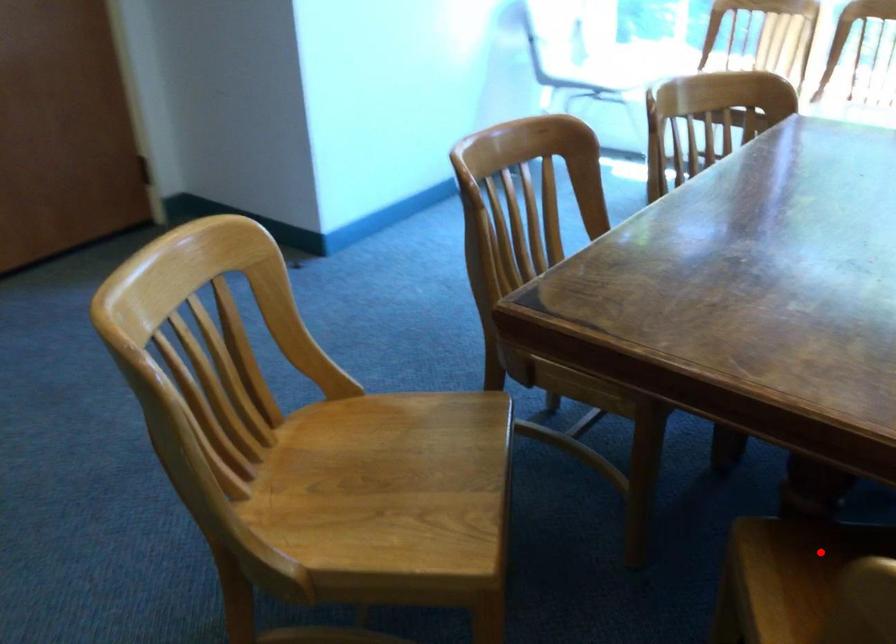
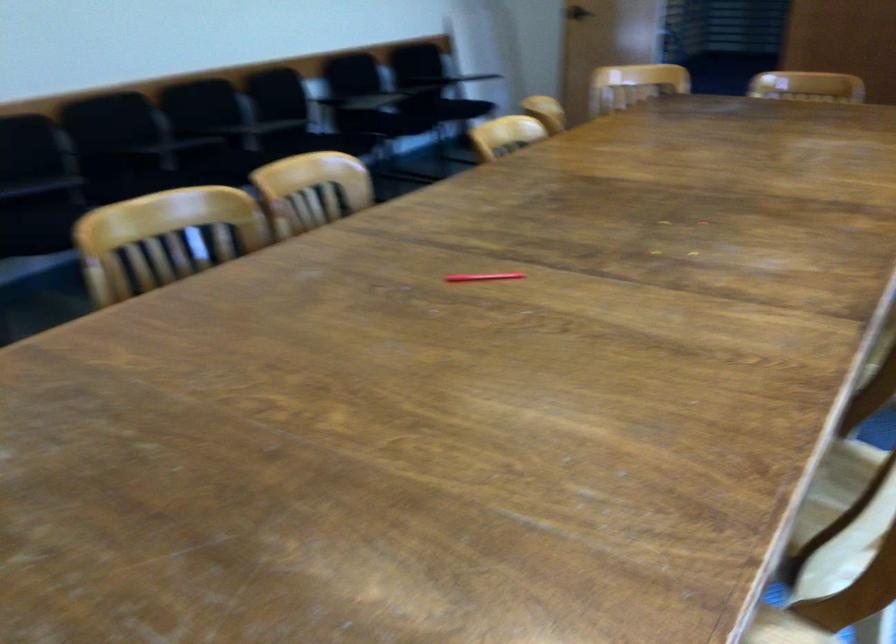
Question: I am providing you with two images of the same scene from different viewpoints. A red point is marked on the first image. At the location where the point appears in image 1, is it still visible in image 2?

Choices:
 (A) Yes
 (B) No

Answer: (B)